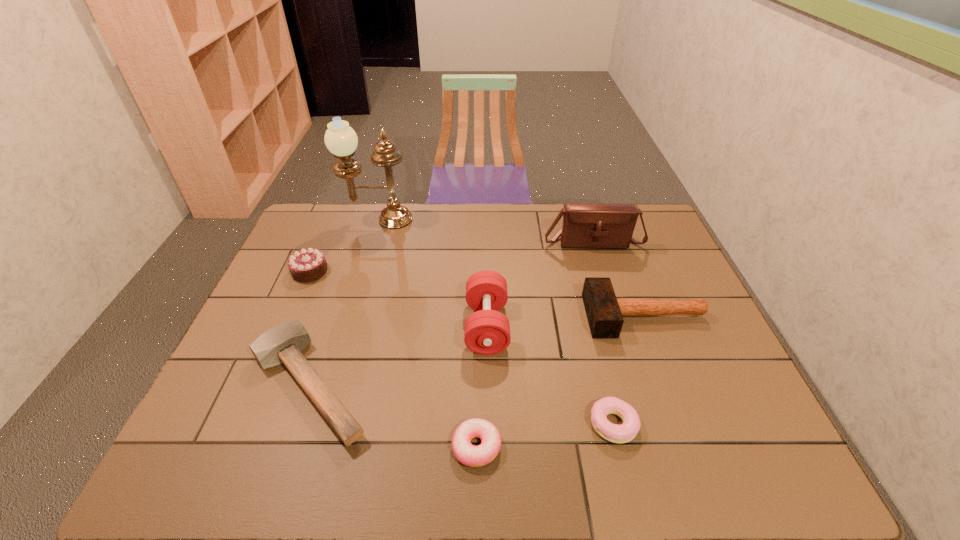
Locate an element on the screen. object that is at the far right corner is located at coordinates (585, 225).

Identify the location of vacant space at the far edge of the desktop. This screenshot has height=540, width=960. (504, 209).

This screenshot has height=540, width=960. In order to click on free space at the near edge in this screenshot , I will do `click(556, 449)`.

The height and width of the screenshot is (540, 960). Identify the location of vacant area at the left edge of the desktop. (286, 312).

At what (x,y) coordinates should I click in order to perform the action: click on free spot at the right edge of the desktop. Please return your answer as a coordinate pair (x, y). Looking at the image, I should click on (690, 282).

Find the location of a particular element. Image resolution: width=960 pixels, height=540 pixels. free region at the far left corner of the desktop is located at coordinates (317, 205).

Locate an element on the screen. This screenshot has height=540, width=960. vacant area that lies between the third tallest object and the left mallet is located at coordinates (398, 355).

Locate an element on the screen. Image resolution: width=960 pixels, height=540 pixels. vacant area between the third farthest object and the tallest object is located at coordinates (344, 245).

This screenshot has height=540, width=960. Find the location of `empty space between the right mallet and the right doughnut`. empty space between the right mallet and the right doughnut is located at coordinates point(629,370).

I want to click on vacant space that's between the left doughnut and the seventh shortest object, so click(x=535, y=344).